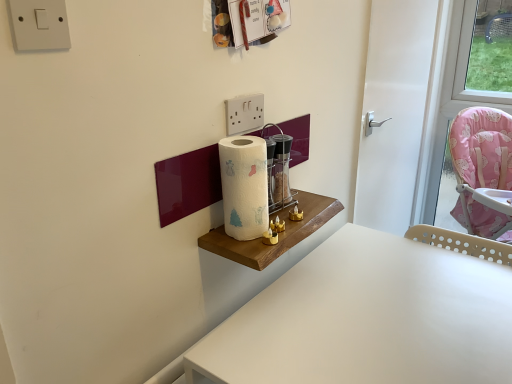
The width and height of the screenshot is (512, 384). What are the coordinates of `free space on the front side of transparent glass wine bottle at center` in the screenshot? It's located at (277, 229).